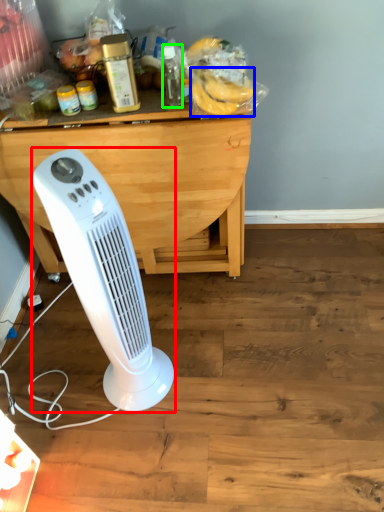
Question: Which object is positioned closest to home appliance (highlighted by a red box)? Select from banana (highlighted by a blue box) and bottle (highlighted by a green box).

Choices:
 (A) banana
 (B) bottle

Answer: (A)